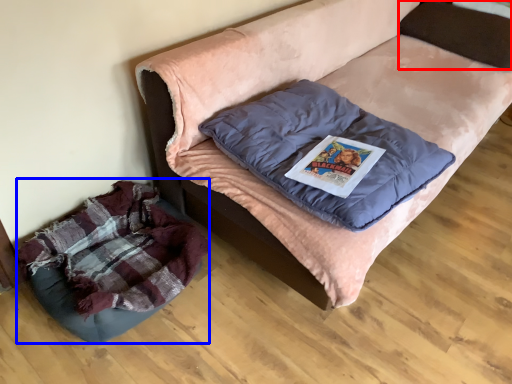
Question: Among these objects, which one is farthest to the camera, pillow (highlighted by a red box) or dog bed (highlighted by a blue box)?

Choices:
 (A) pillow
 (B) dog bed

Answer: (A)